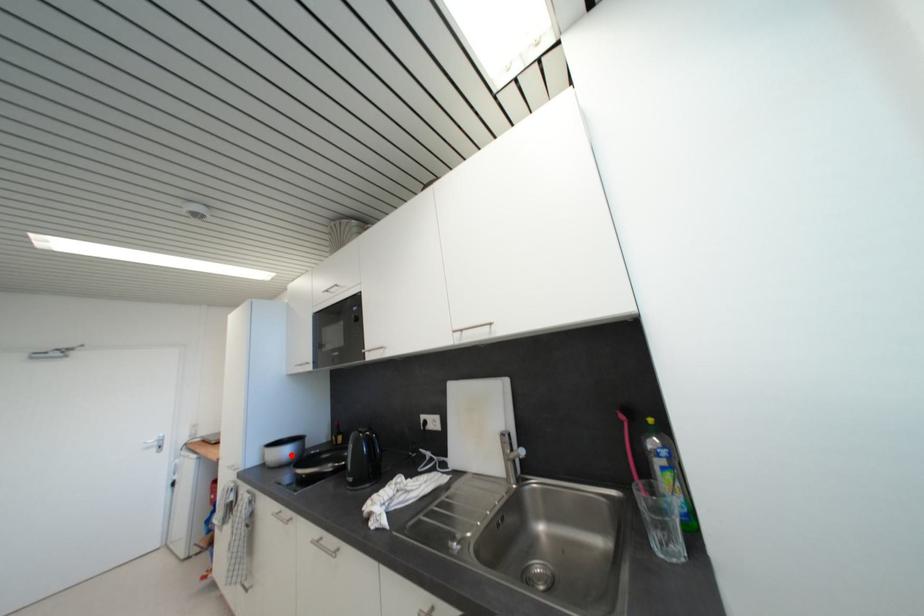
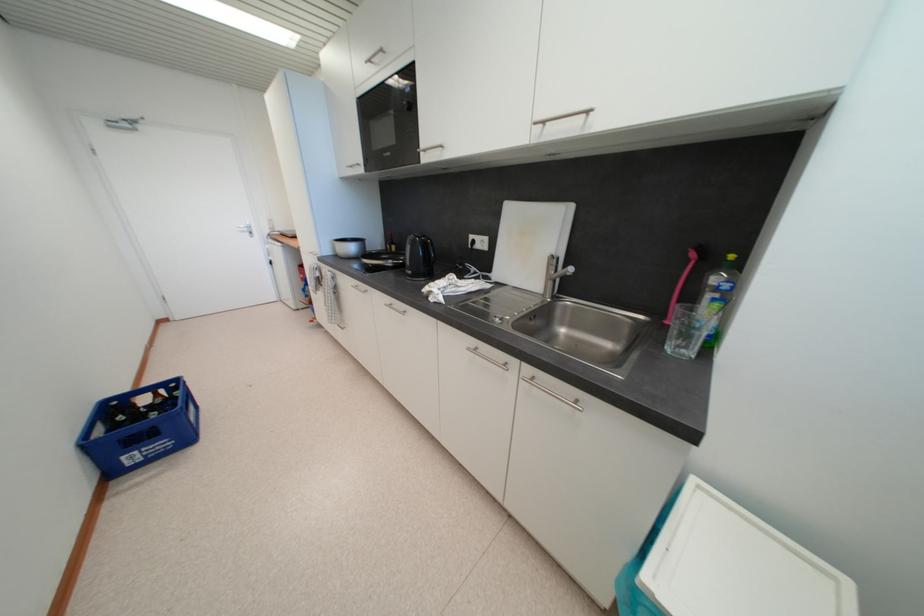
Locate, in the second image, the point that corresponds to the highlighted location in the first image.

(357, 251)